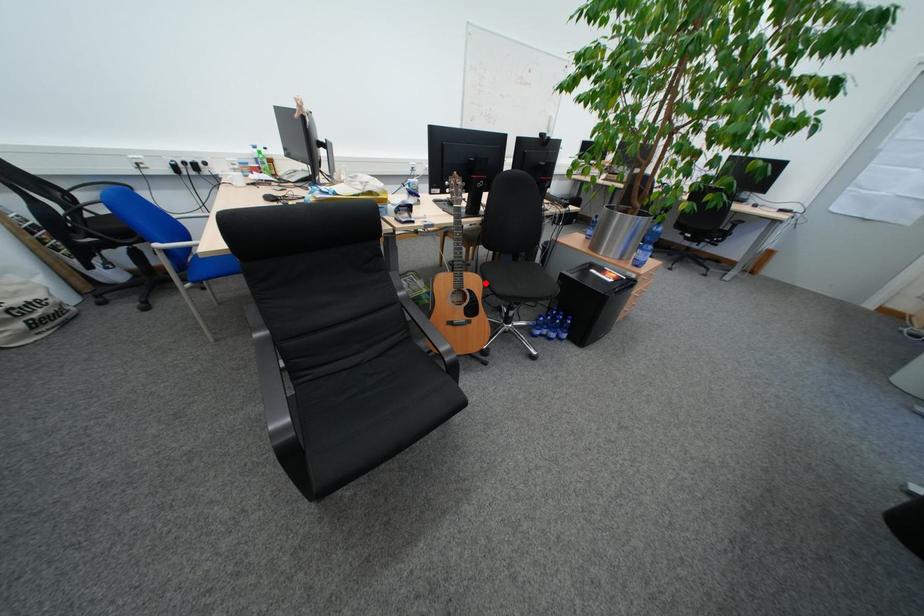
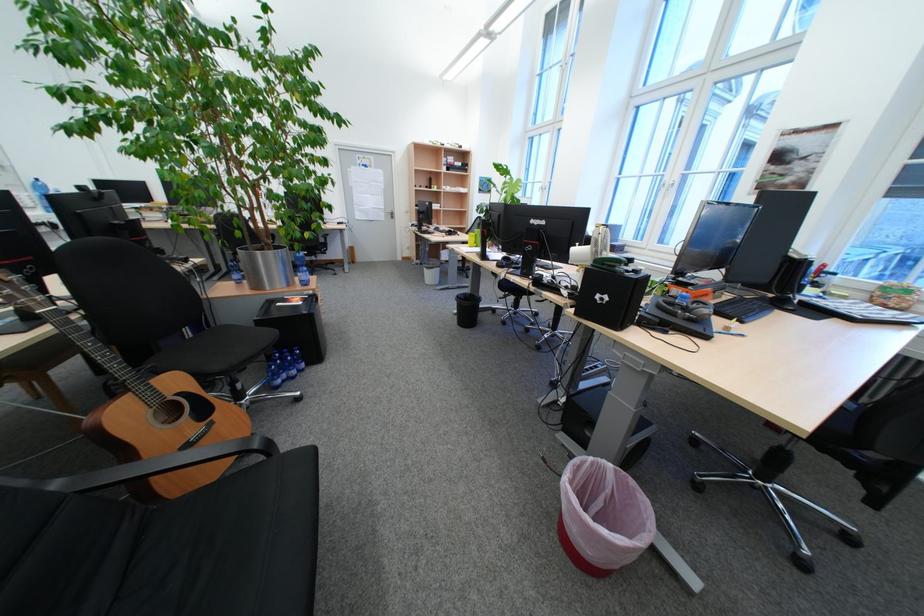
The point at the highlighted location is marked in the first image. Where is the corresponding point in the second image?

(187, 383)